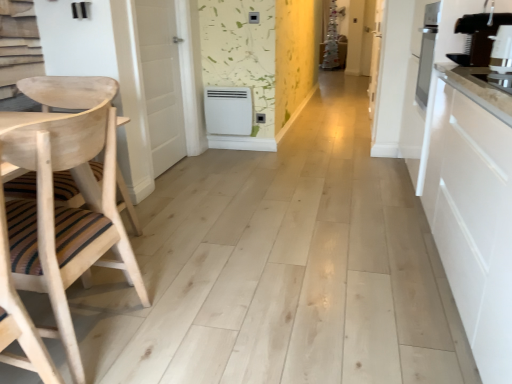
Question: From a real-world perspective, is white wood door at center, the second door positioned from the left, physically located above or below white smooth door at left, which is the 2th door in right-to-left order?

Choices:
 (A) below
 (B) above

Answer: (B)

Question: Is white wood door at center, arranged as the second door when viewed from the front, in front of or behind white smooth door at left, which is the 2th door in right-to-left order, in the image?

Choices:
 (A) behind
 (B) front

Answer: (A)

Question: Estimate the real-world distances between objects in this image. Which object is closer to the natural wood chair at left?

Choices:
 (A) white wood door at center, the second door positioned from the left
 (B) black plastic coffee machine at right
 (C) white plastic heater at center
 (D) white smooth door at left, which is the 2th door in right-to-left order

Answer: (D)

Question: Based on their relative distances, which object is farther from the white plastic heater at center?

Choices:
 (A) white wood door at center, which is counted as the first door, starting from the right
 (B) white smooth door at left, the 2th door viewed from the back
 (C) black plastic coffee machine at right
 (D) natural wood chair at left

Answer: (D)